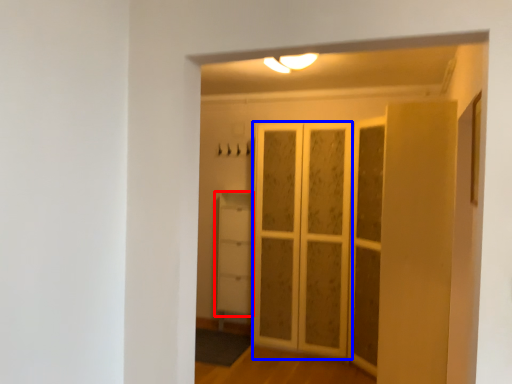
Question: Which of the following is the closest to the observer, cupboard (highlighted by a red box) or screen door (highlighted by a blue box)?

Choices:
 (A) cupboard
 (B) screen door

Answer: (B)